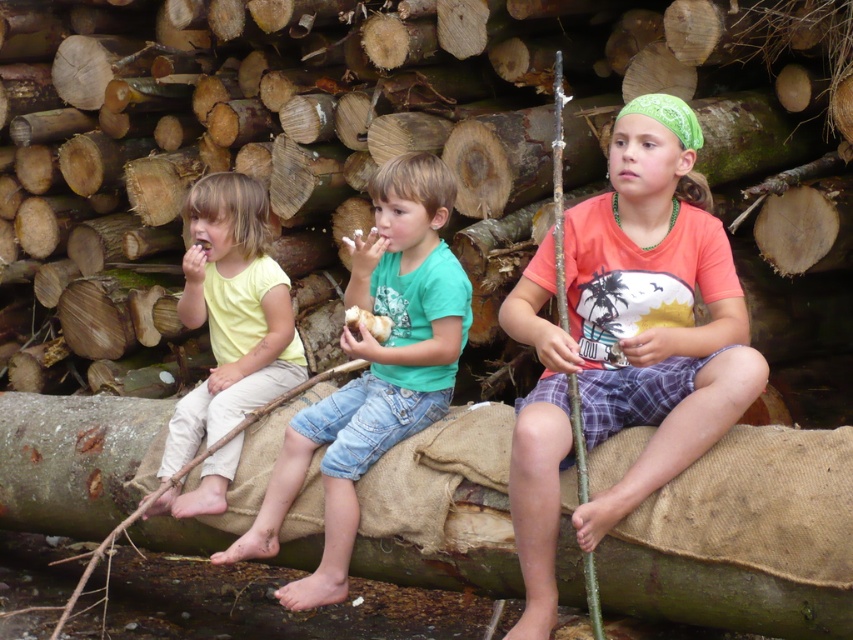
Question: In this image, where is orange cotton shirt at center located relative to light yellow t-shirt at left?

Choices:
 (A) left
 (B) right

Answer: (B)

Question: Which of these objects is positioned closest to the green cotton shirt at center?

Choices:
 (A) orange cotton shirt at center
 (B) greenish-brown bark pole at center

Answer: (A)

Question: Is light yellow t-shirt at left above greenish-brown bark pole at center?

Choices:
 (A) no
 (B) yes

Answer: (A)

Question: Which object is positioned closest to the greenish-brown bark pole at center?

Choices:
 (A) brown rough wood at center
 (B) green cotton shirt at center
 (C) light yellow t-shirt at left
 (D) orange cotton shirt at center

Answer: (D)

Question: Is green cotton shirt at center above greenish-brown bark pole at center?

Choices:
 (A) yes
 (B) no

Answer: (B)

Question: Which point is farther from the camera taking this photo?

Choices:
 (A) (520, 189)
 (B) (537, 456)

Answer: (A)